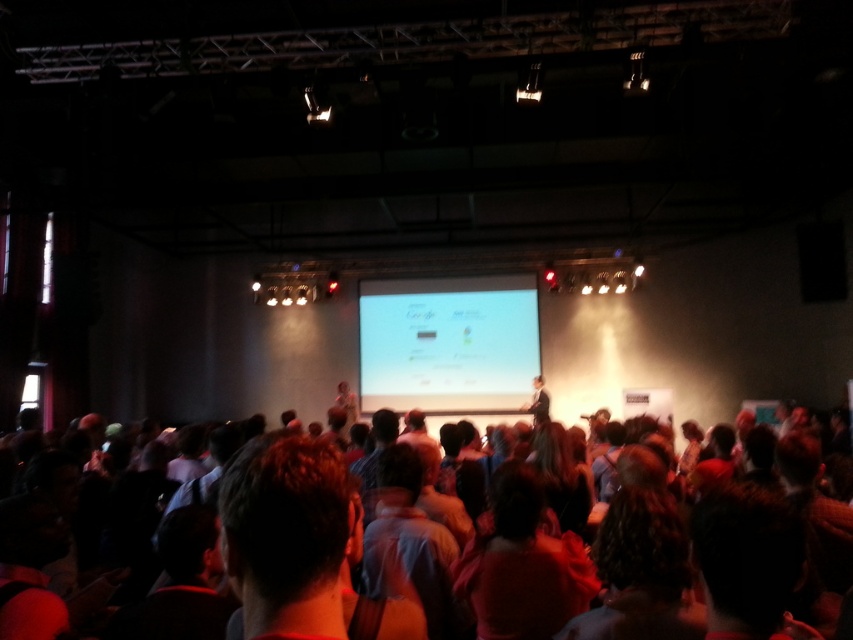
You are sitting in the front row of the conference hall and see two points marked in the scene. Which point is closer to you, point (x=390, y=362) or point (x=727, y=486)?

Point (x=390, y=362) is further to the camera than point (x=727, y=486), so the point closer to you is point (x=727, y=486).